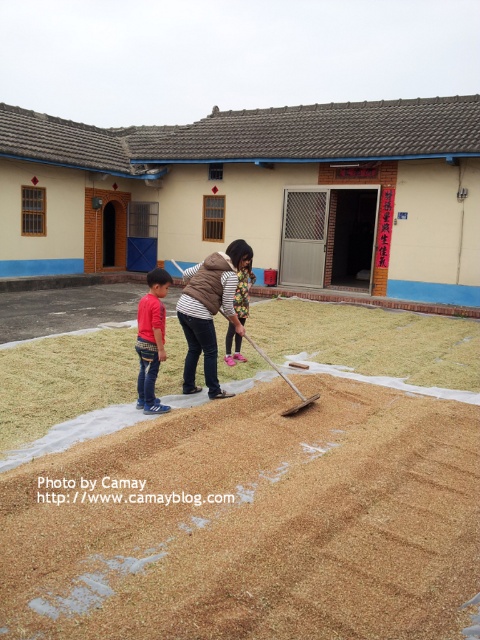
Based on the photo, you are standing in the courtyard and want to place a small potted plant between the brown grainy sand at lower center and the red cotton shirt at lower left. Which object should the plant be closer to if it needs to be placed at the same level as the sand?

The plant should be placed closer to the brown grainy sand at lower center because it has a lesser height compared to the red cotton shirt at lower left, so positioning it near the sand will keep it at the same level.

You are a visitor in this courtyard and see the brown woolen vest at center and the red cotton shirt at lower left. Which clothing item is positioned higher relative to the other?

The brown woolen vest at center is above the red cotton shirt at lower left, so it is positioned higher.

You are standing in the courtyard and want to take a photo of both the point at coordinates [441,536] and the point at [195,388]. Which point will appear larger in your photo?

Point at coordinates [441,536] will appear larger in the photo because it is closer to the camera than point at [195,388].